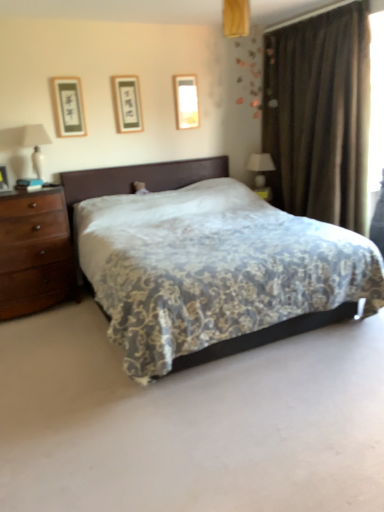
Question: From a real-world perspective, is floral-patterned fabric bed at center over brown velvet curtain at right?

Choices:
 (A) yes
 (B) no

Answer: (B)

Question: Does floral-patterned fabric bed at center have a larger size compared to brown velvet curtain at right?

Choices:
 (A) no
 (B) yes

Answer: (B)

Question: Is floral-patterned fabric bed at center aimed at brown velvet curtain at right?

Choices:
 (A) no
 (B) yes

Answer: (A)

Question: Is floral-patterned fabric bed at center oriented away from brown velvet curtain at right?

Choices:
 (A) yes
 (B) no

Answer: (B)

Question: Is floral-patterned fabric bed at center at the right side of brown velvet curtain at right?

Choices:
 (A) yes
 (B) no

Answer: (B)

Question: Is matte glass picture frame at upper center, arranged as the 1th picture frame when viewed from the right, inside the boundaries of white glossy table lamp at upper right, which appears as the 2th table lamp when viewed from the front, or outside?

Choices:
 (A) outside
 (B) inside

Answer: (A)

Question: Looking at their shapes, would you say matte glass picture frame at upper center, placed as the 3th picture frame when sorted from front to back, is wider or thinner than white glossy table lamp at upper right, placed as the first table lamp when sorted from back to front?

Choices:
 (A) wide
 (B) thin

Answer: (B)

Question: In terms of height, does matte glass picture frame at upper center, which is the 1th picture frame from back to front, look taller or shorter compared to white glossy table lamp at upper right, which appears as the 2th table lamp when viewed from the front?

Choices:
 (A) tall
 (B) short

Answer: (B)

Question: In the image, is matte glass picture frame at upper center, arranged as the 3th picture frame when viewed from the left, on the left side or the right side of white glossy table lamp at upper right, which is counted as the second table lamp, starting from the left?

Choices:
 (A) left
 (B) right

Answer: (A)

Question: Choose the correct answer: Is matte glass picture frame at upper center, which is the 1th picture frame from back to front, inside matte black picture frame at upper left, acting as the first picture frame starting from the front, or outside it?

Choices:
 (A) inside
 (B) outside

Answer: (B)

Question: Based on their sizes in the image, would you say matte glass picture frame at upper center, arranged as the 1th picture frame when viewed from the right, is bigger or smaller than matte black picture frame at upper left, acting as the first picture frame starting from the front?

Choices:
 (A) big
 (B) small

Answer: (B)

Question: Is matte glass picture frame at upper center, arranged as the 3th picture frame when viewed from the left, taller or shorter than matte black picture frame at upper left, the 3th picture frame when ordered from back to front?

Choices:
 (A) short
 (B) tall

Answer: (A)

Question: From the image's perspective, is matte glass picture frame at upper center, which is the 1th picture frame from back to front, located above or below matte black picture frame at upper left, placed as the first picture frame when sorted from left to right?

Choices:
 (A) above
 (B) below

Answer: (A)

Question: Based on their sizes in the image, would you say black paper picture frame at upper center, placed as the 2th picture frame when sorted from left to right, is bigger or smaller than brown velvet curtain at right?

Choices:
 (A) big
 (B) small

Answer: (B)

Question: From the image's perspective, relative to brown velvet curtain at right, is black paper picture frame at upper center, the second picture frame viewed from the back, above or below?

Choices:
 (A) above
 (B) below

Answer: (A)